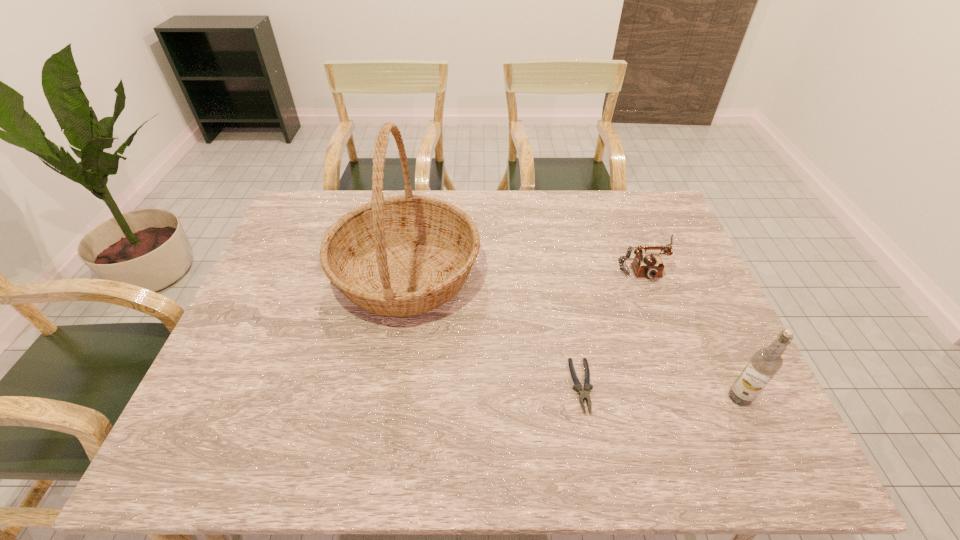
Locate an element on the screen. The height and width of the screenshot is (540, 960). empty space that is in between the vodka and the shortest object is located at coordinates (660, 392).

The height and width of the screenshot is (540, 960). Find the location of `empty location between the vodka and the second shortest object`. empty location between the vodka and the second shortest object is located at coordinates (694, 328).

Image resolution: width=960 pixels, height=540 pixels. What are the coordinates of `free spot between the telephone and the tallest object` in the screenshot? It's located at (527, 266).

The image size is (960, 540). What are the coordinates of `free space between the shortest object and the telephone` in the screenshot? It's located at (615, 322).

Locate an element on the screen. The image size is (960, 540). unoccupied position between the third object from right to left and the telephone is located at coordinates (615, 322).

The width and height of the screenshot is (960, 540). Find the location of `unoccupied position between the basket and the telephone`. unoccupied position between the basket and the telephone is located at coordinates 527,266.

Where is `free spot between the telephone and the pliers`? This screenshot has width=960, height=540. free spot between the telephone and the pliers is located at coordinates (615, 322).

I want to click on empty location between the basket and the vodka, so click(x=573, y=335).

The height and width of the screenshot is (540, 960). Find the location of `blank region between the telephone and the pliers`. blank region between the telephone and the pliers is located at coordinates (615, 322).

I want to click on free space between the third tallest object and the leftmost object, so click(527, 266).